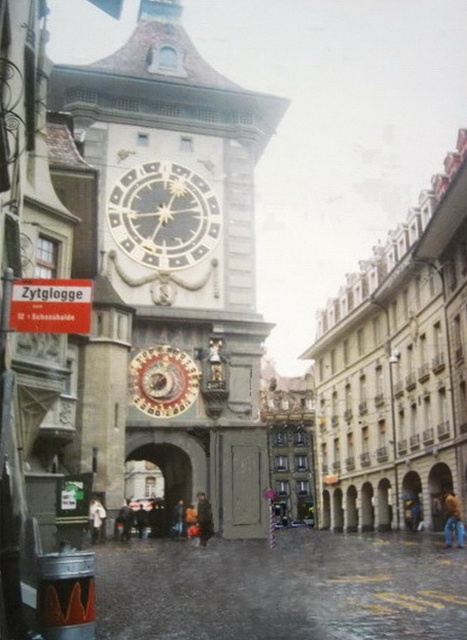
Is stone clock tower at center to the right of dark gray metal clock at center from the viewer's perspective?

No, stone clock tower at center is not to the right of dark gray metal clock at center.

Between point (138, 42) and point (129, 250), which one is positioned behind?

The point (138, 42) is more distant.

Image resolution: width=467 pixels, height=640 pixels. In order to click on stone clock tower at center in this screenshot , I will do `click(178, 259)`.

In order to click on stone clock tower at center in this screenshot , I will do `click(178, 259)`.